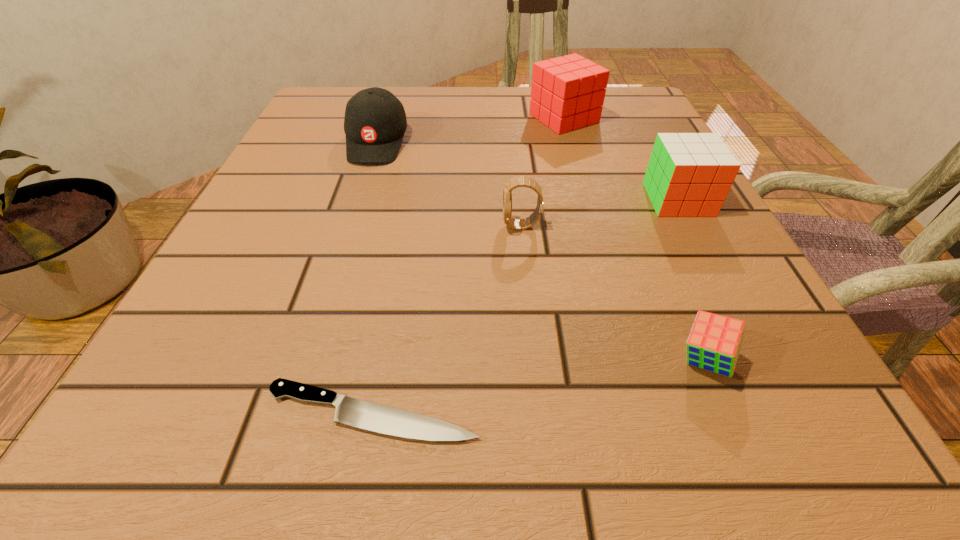
This screenshot has height=540, width=960. I want to click on free space located on the face of the watch, so click(436, 226).

The image size is (960, 540). Find the location of `vacant position located on the face of the watch`. vacant position located on the face of the watch is located at coordinates (364, 226).

The image size is (960, 540). Identify the location of free space located 0.380m on the face of the watch. (273, 226).

Locate an element on the screen. This screenshot has width=960, height=540. vacant area situated 0.160m on the left of the shortest cube is located at coordinates (543, 360).

I want to click on free space located 0.120m on the back of the steak knife, so click(x=392, y=306).

Find the location of a particular element. cube that is at the far edge is located at coordinates (567, 93).

This screenshot has width=960, height=540. I want to click on baseball cap located in the far edge section of the desktop, so point(375,122).

Locate an element on the screen. Image resolution: width=960 pixels, height=540 pixels. object at the near edge is located at coordinates (349, 411).

This screenshot has height=540, width=960. I want to click on baseball cap that is at the left edge, so click(375, 122).

The image size is (960, 540). I want to click on steak knife positioned at the left edge, so click(349, 411).